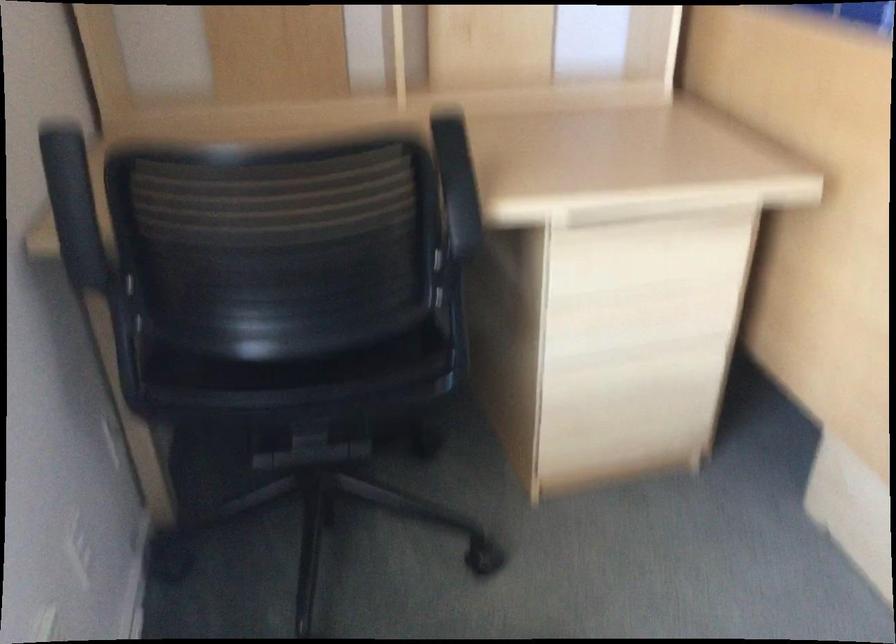
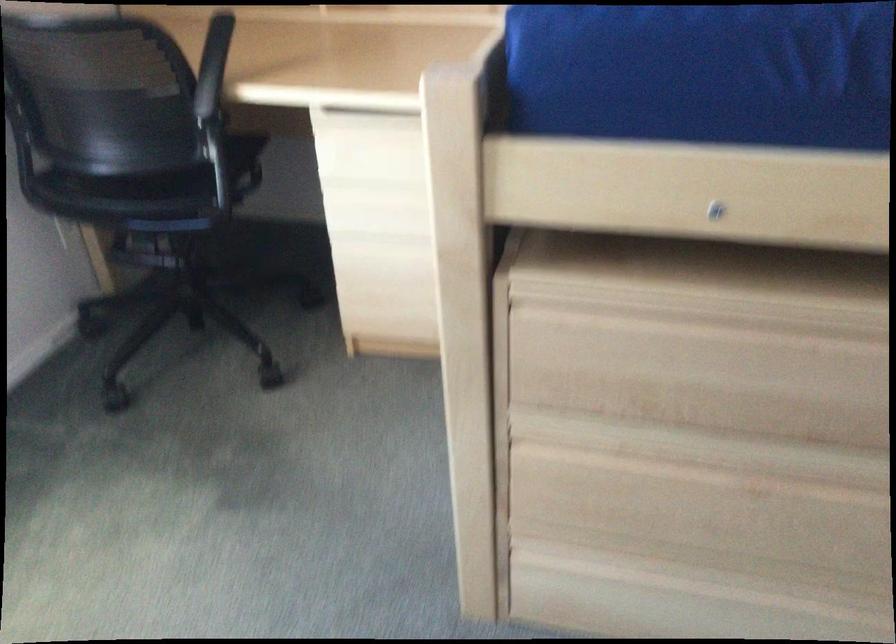
Find the pixel in the second image that matches point 474,182 in the first image.

(212, 66)